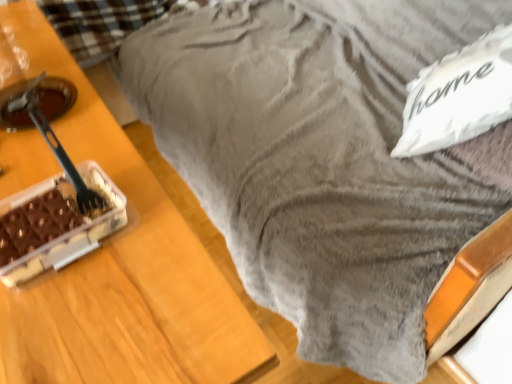
Question: From a real-world perspective, is chocolate matte cake at left under black plastic fork at left?

Choices:
 (A) no
 (B) yes

Answer: (B)

Question: Is chocolate matte cake at left further to camera compared to black plastic fork at left?

Choices:
 (A) yes
 (B) no

Answer: (B)

Question: Does chocolate matte cake at left have a lesser height compared to black plastic fork at left?

Choices:
 (A) yes
 (B) no

Answer: (A)

Question: Does chocolate matte cake at left appear on the left side of black plastic fork at left?

Choices:
 (A) no
 (B) yes

Answer: (A)

Question: Is chocolate matte cake at left facing towards black plastic fork at left?

Choices:
 (A) no
 (B) yes

Answer: (A)

Question: From the image's perspective, relative to chocolate matte cake at left, is black plastic fork at left above or below?

Choices:
 (A) below
 (B) above

Answer: (B)

Question: Considering the positions of point (80, 187) and point (48, 241), is point (80, 187) closer or farther from the camera than point (48, 241)?

Choices:
 (A) closer
 (B) farther

Answer: (B)

Question: Is black plastic fork at left taller or shorter than chocolate matte cake at left?

Choices:
 (A) tall
 (B) short

Answer: (A)

Question: In the image, is black plastic fork at left on the left side or the right side of chocolate matte cake at left?

Choices:
 (A) right
 (B) left

Answer: (B)

Question: Considering the positions of chocolate matte cake at left and white fluffy pillow at upper right in the image, is chocolate matte cake at left taller or shorter than white fluffy pillow at upper right?

Choices:
 (A) tall
 (B) short

Answer: (B)

Question: Is point (54, 241) positioned closer to the camera than point (433, 142)?

Choices:
 (A) farther
 (B) closer

Answer: (B)

Question: Considering their positions, is chocolate matte cake at left located in front of or behind white fluffy pillow at upper right?

Choices:
 (A) behind
 (B) front

Answer: (B)

Question: Visually, is chocolate matte cake at left positioned to the left or to the right of white fluffy pillow at upper right?

Choices:
 (A) left
 (B) right

Answer: (A)

Question: Considering the positions of black plastic fork at left and white fluffy pillow at upper right in the image, is black plastic fork at left wider or thinner than white fluffy pillow at upper right?

Choices:
 (A) wide
 (B) thin

Answer: (B)

Question: Is point (87, 205) positioned closer to the camera than point (443, 76)?

Choices:
 (A) closer
 (B) farther

Answer: (A)